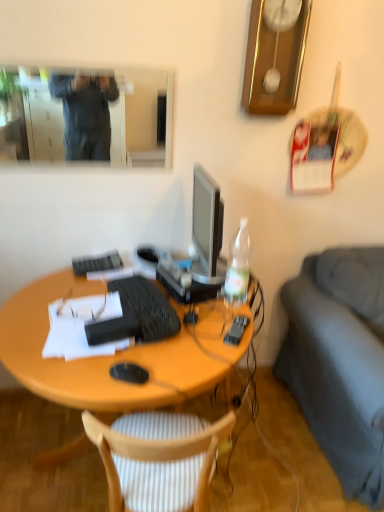
This screenshot has height=512, width=384. Find the location of `vacant area that is in front of black matte computer mouse at center`. vacant area that is in front of black matte computer mouse at center is located at coordinates click(121, 391).